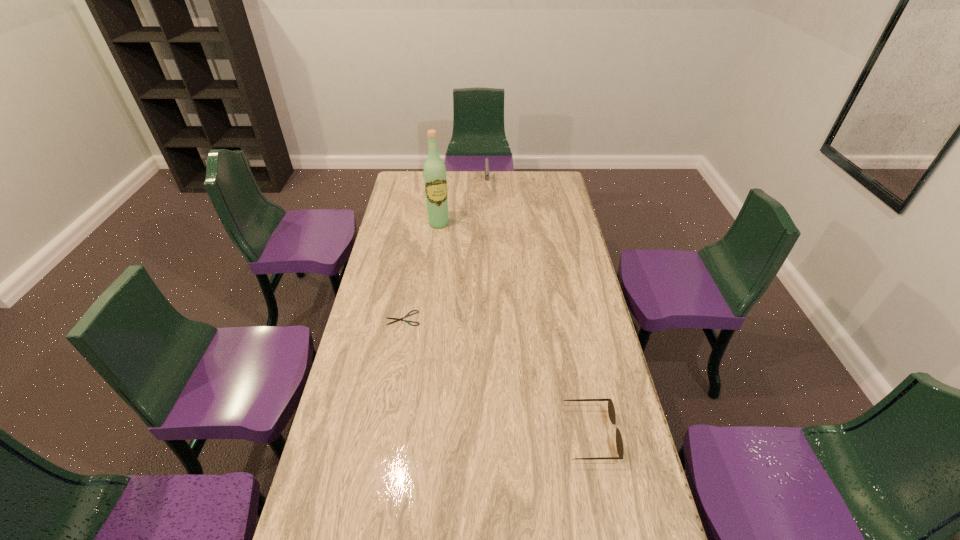
Find the location of a particular element. The width and height of the screenshot is (960, 540). vacant space that satisfies the following two spatial constraints: 1. on the back side of the wine bottle; 2. on the right side of the shears is located at coordinates (420, 224).

Find the location of a particular element. This screenshot has width=960, height=540. free spot that satisfies the following two spatial constraints: 1. on the front side of the sunglasses; 2. on the front-facing side of the second nearest object is located at coordinates (383, 434).

At what (x,y) coordinates should I click in order to perform the action: click on free spot that satisfies the following two spatial constraints: 1. on the front side of the third tallest object; 2. on the front-facing side of the tallest object. Please return your answer as a coordinate pair (x, y). The image size is (960, 540). Looking at the image, I should click on (414, 434).